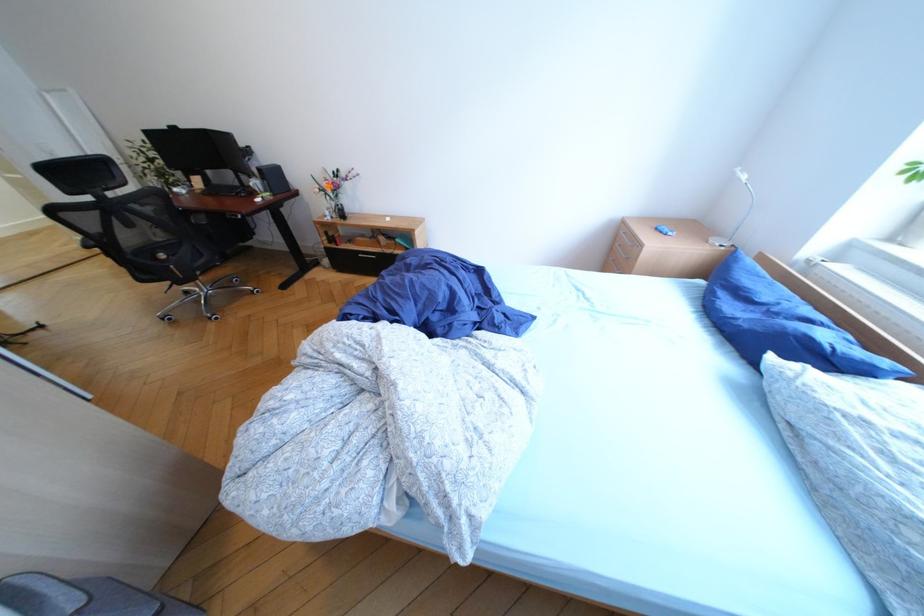
Locate an element on the screen. The image size is (924, 616). white gooseneck lamp is located at coordinates (736, 211).